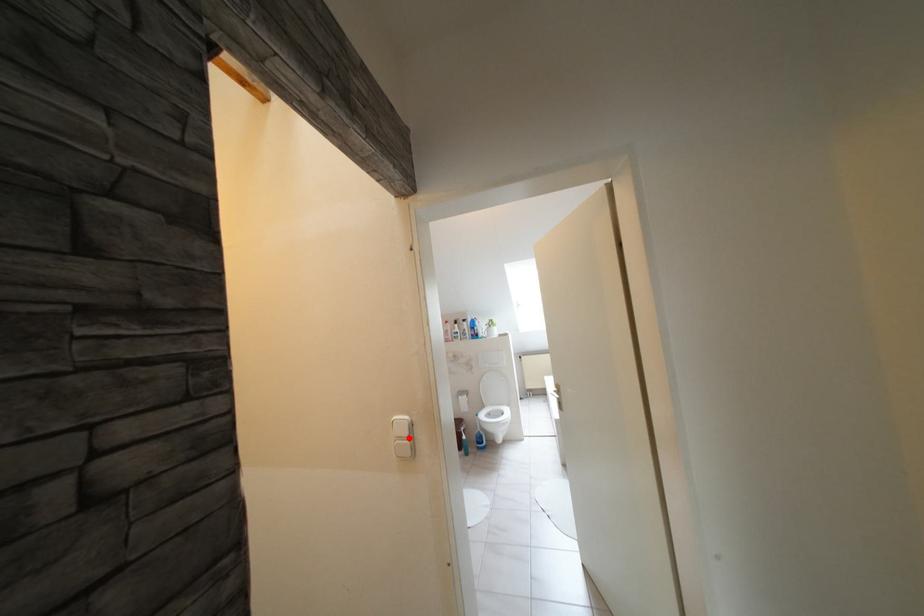
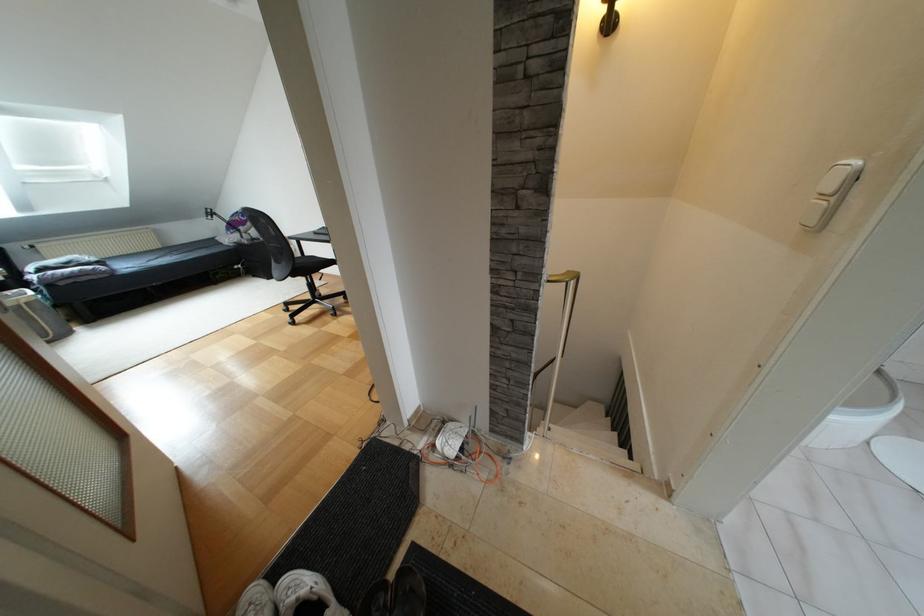
In the second image, find the point that corresponds to the highlighted location in the first image.

(833, 198)